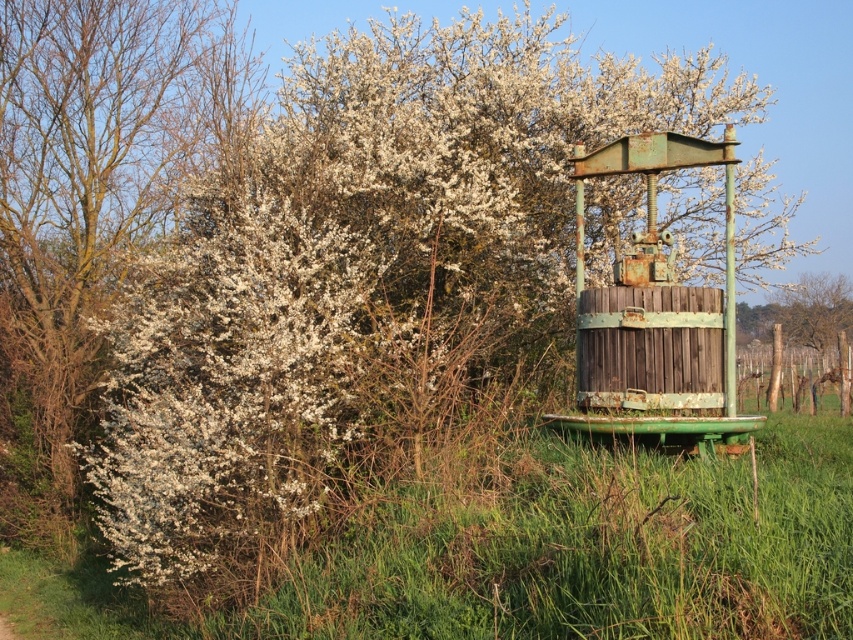
Question: Which point is farther from the camera taking this photo?

Choices:
 (A) (27, 296)
 (B) (830, 616)

Answer: (A)

Question: Can you confirm if green grass at right is smaller than white blossoms at left?

Choices:
 (A) no
 (B) yes

Answer: (B)

Question: Which point appears farthest from the camera in this image?

Choices:
 (A) (328, 564)
 (B) (15, 195)

Answer: (B)

Question: Is green grass at right positioned at the back of white blossoms at left?

Choices:
 (A) no
 (B) yes

Answer: (A)

Question: Does green grass at right have a greater width compared to white blossoms at left?

Choices:
 (A) yes
 (B) no

Answer: (B)